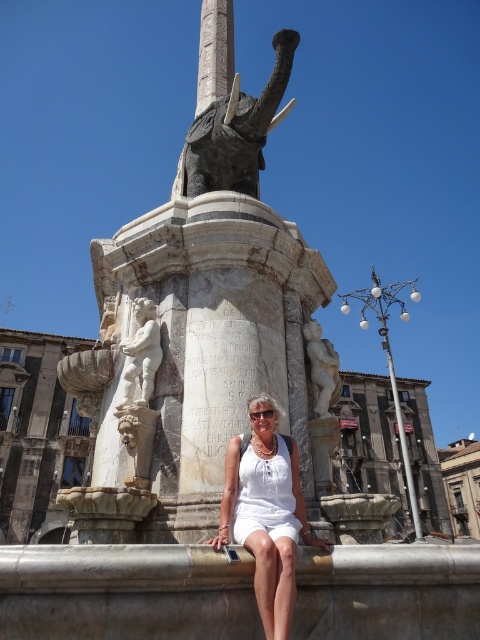
You are an art student analyzing the monument. You observe the white marble cherub at lower left and the white marble cherub at center. Which cherub is taller?

The white marble cherub at lower left is taller than the white marble cherub at center.

You are a tourist standing in front of the monument and want to take a photo of both the polished stone elephant at center and the bronze elephant at upper center. Which direction should you move to ensure both are visible in your camera frame?

You should move to the right so that both the polished stone elephant at center and the bronze elephant at upper center are visible in your camera frame, since the polished stone elephant at center is to the left of the bronze elephant at upper center.

You are an architect designing a miniature model of this monument. You need to ensure that the white marble cherub at lower left and the white marble cherub at center are scaled appropriately. Which cherub should you make smaller in your model to maintain the correct proportions?

The white marble cherub at lower left should be made smaller in the model because it occupies less space than the white marble cherub at center in the original monument.